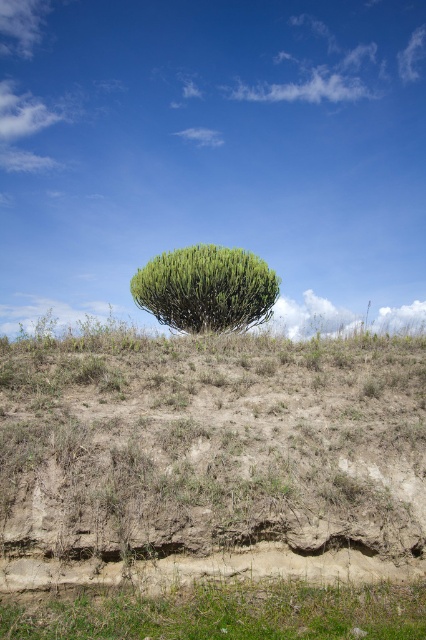
Question: Does green grassy hillside at center have a smaller size compared to green grassy at lower center?

Choices:
 (A) no
 (B) yes

Answer: (A)

Question: Which object is farther from the camera taking this photo?

Choices:
 (A) green grassy at lower center
 (B) green grassy hillside at center
 (C) green leafy tree at center

Answer: (C)

Question: Which point is closer to the camera?

Choices:
 (A) 19,620
 (B) 219,248
 (C) 117,344

Answer: (A)

Question: Is green grassy hillside at center smaller than green leafy tree at center?

Choices:
 (A) yes
 (B) no

Answer: (B)

Question: Which point appears farthest from the camera in this image?

Choices:
 (A) (172, 602)
 (B) (264, 312)

Answer: (B)

Question: Is green grassy hillside at center wider than green leafy tree at center?

Choices:
 (A) no
 (B) yes

Answer: (B)